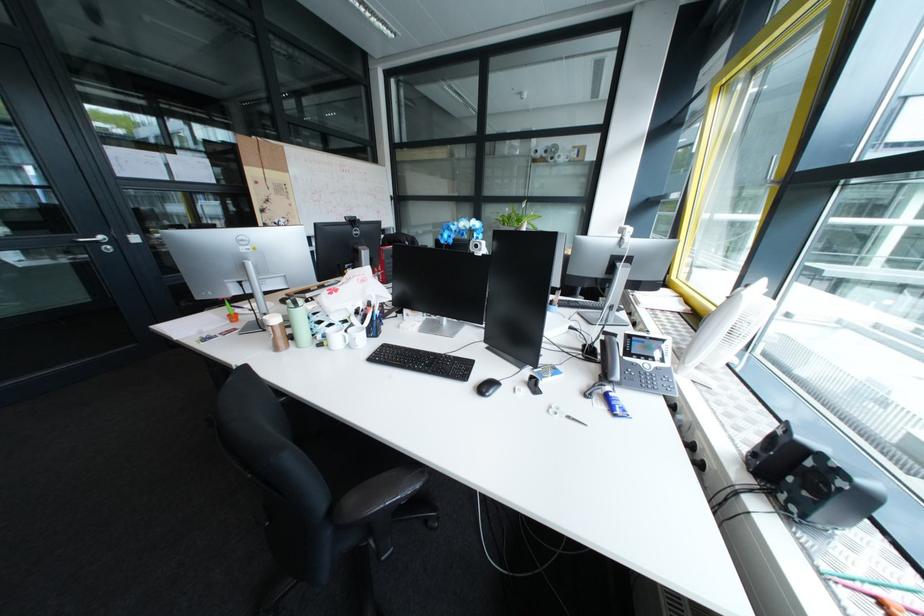
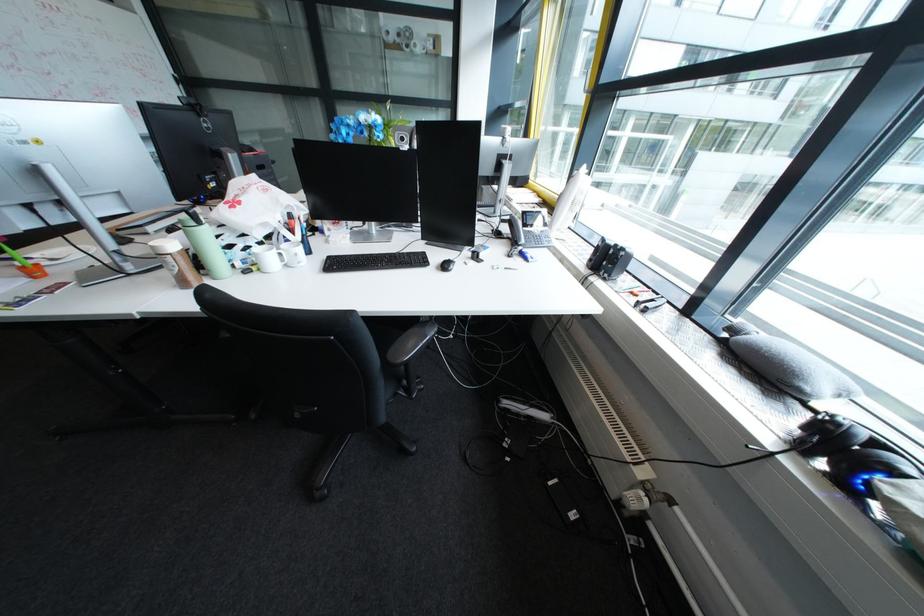
First-person continuous shooting, in which direction is the camera rotating?

The camera rotated toward right-down.